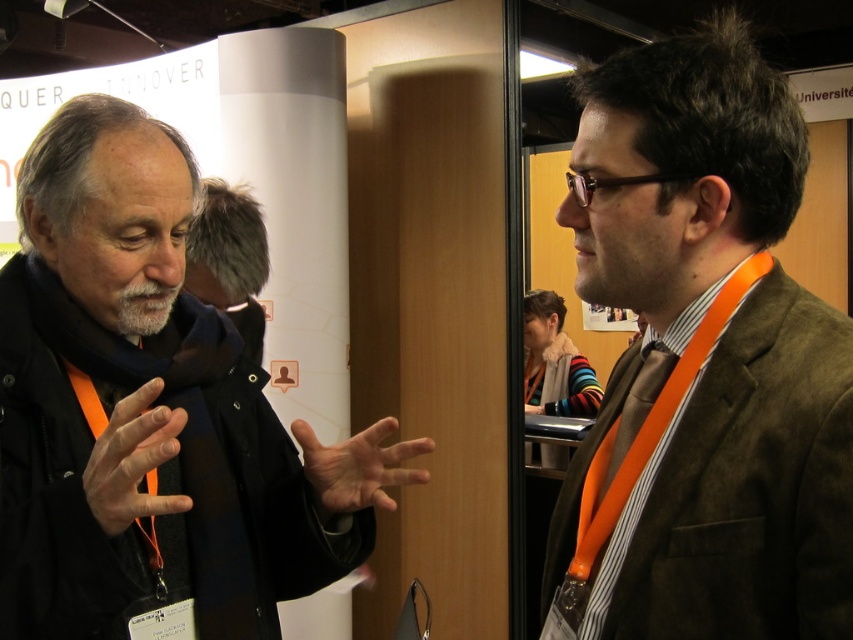
You are organizing a photo shoot and need to ensure that the outfits of the two individuals in the scene are correctly sized for their roles. Given that the brown woolen suit at right is smaller than the matte black jacket at left, which outfit should you adjust to match the other in size?

The brown woolen suit at right is smaller than the matte black jacket at left, so you should adjust the brown woolen suit at right to be larger to match the size of the matte black jacket at left.

You are a photographer standing at the center of the room. You want to take a photo that includes both the brown woolen suit at right and the fuzzy gray hat at upper left. Given that your camera has a maximum field of view of 4 feet, will you be able to capture both in a single shot?

The distance between the brown woolen suit at right and the fuzzy gray hat at upper left is 4.29 feet, which exceeds the camera field of view of 4 feet. Therefore, you cannot capture both in a single shot.